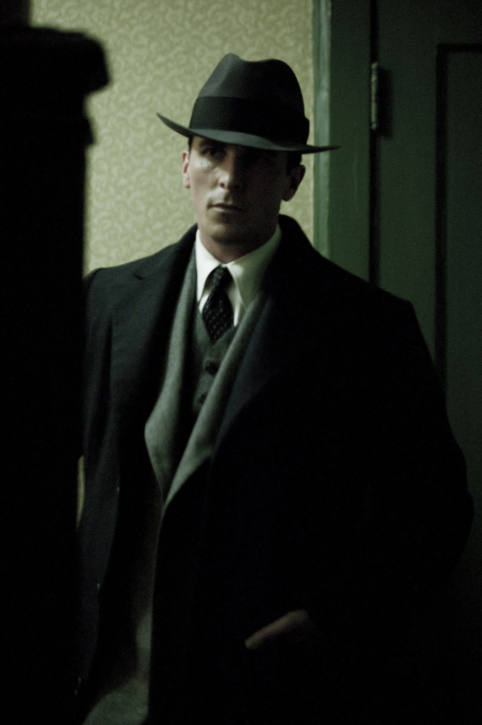
The image size is (482, 725). In order to click on door frame in this screenshot , I will do coord(353,96).